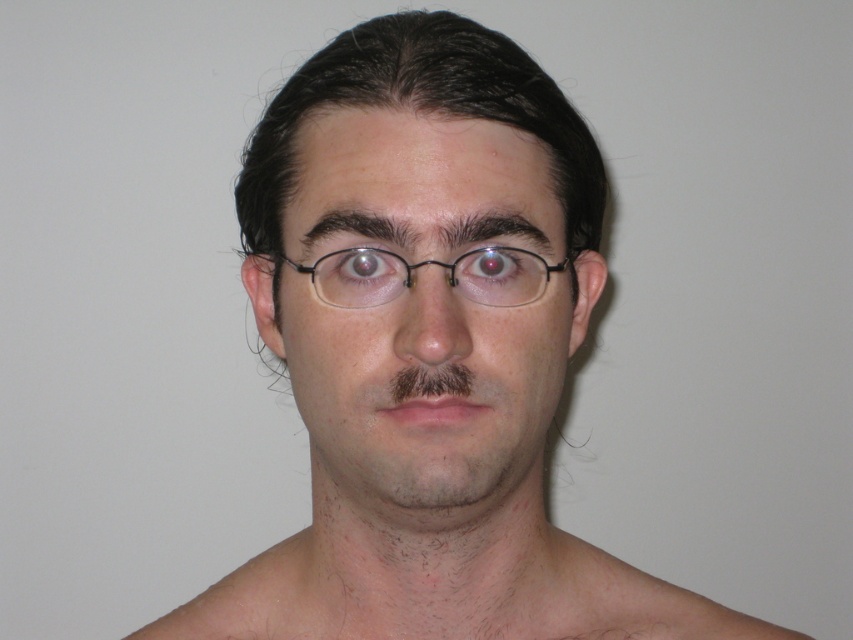
You are a photographer adjusting the focus of your camera. You have two points to focus on in the image, point 1 at point [526,230] and point 2 at point [471,292]. Which point is closer to the camera lens?

Point 1 at point [526,230] is closer to the camera lens because it is further to the camera than point 2 at point [471,292].

You are a photographer adjusting the focus of your camera. The camera has a focus point at the center of the viewfinder. The smooth skin face at center is located at point 0.484, 0.496. Is the face centered enough for the focus point to capture it clearly?

The smooth skin face at center is located at point (422, 308), which is very close to the center coordinates of (426, 320). Therefore, the face is centered enough for the focus point to capture it clearly.

You are a photographer adjusting your camera settings to focus on the subject in the image. You notice the smooth skin face at center and the glossy white eye at upper center. Which object should you focus on first to ensure proper depth of field?

The smooth skin face at center is closer to the viewer than the glossy white eye at upper center, so you should focus on the smooth skin face at center first to ensure proper depth of field.